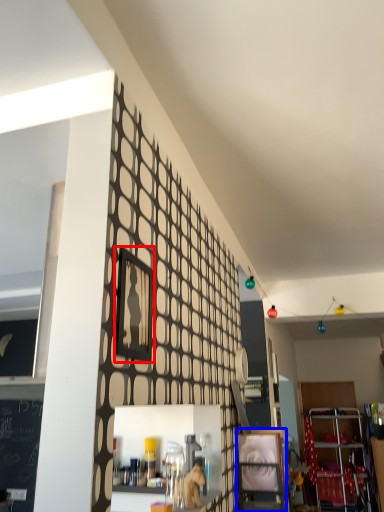
Question: Which object appears closest to the camera in this image, picture frame (highlighted by a red box) or shelf (highlighted by a blue box)?

Choices:
 (A) picture frame
 (B) shelf

Answer: (A)